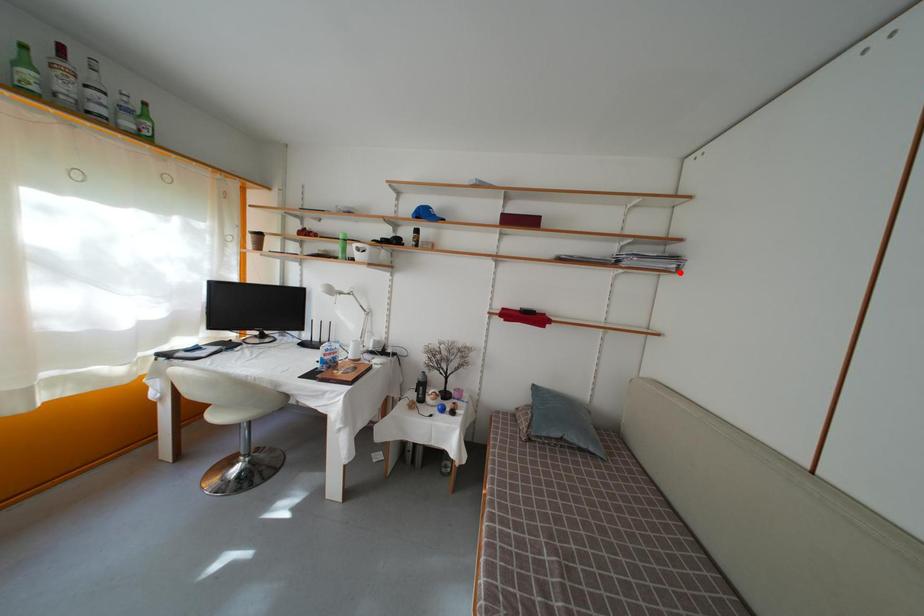
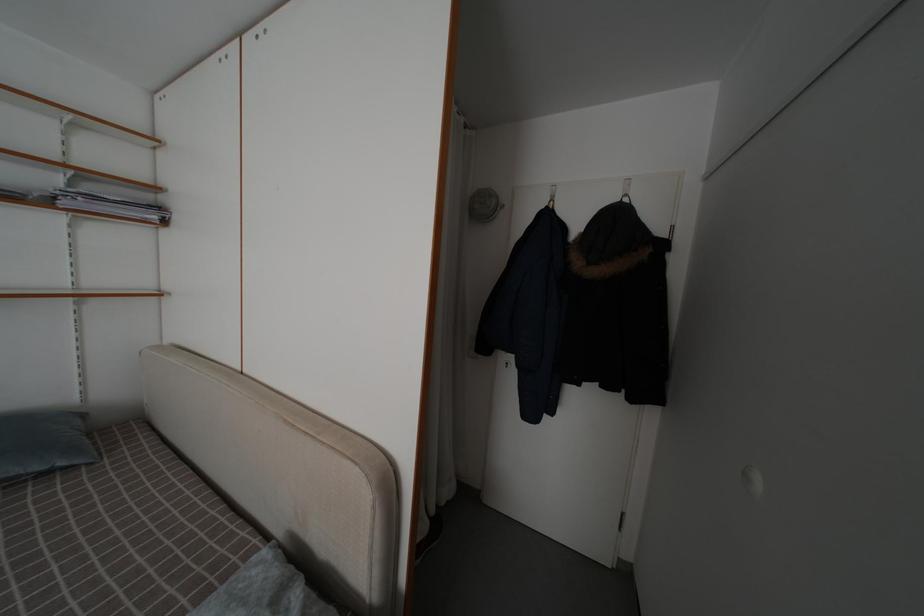
Question: I am providing you with two images of the same scene from different viewpoints. A red point is marked on the first image. At the location where the point appears in image 1, is it still visible in image 2?

Choices:
 (A) Yes
 (B) No

Answer: (A)